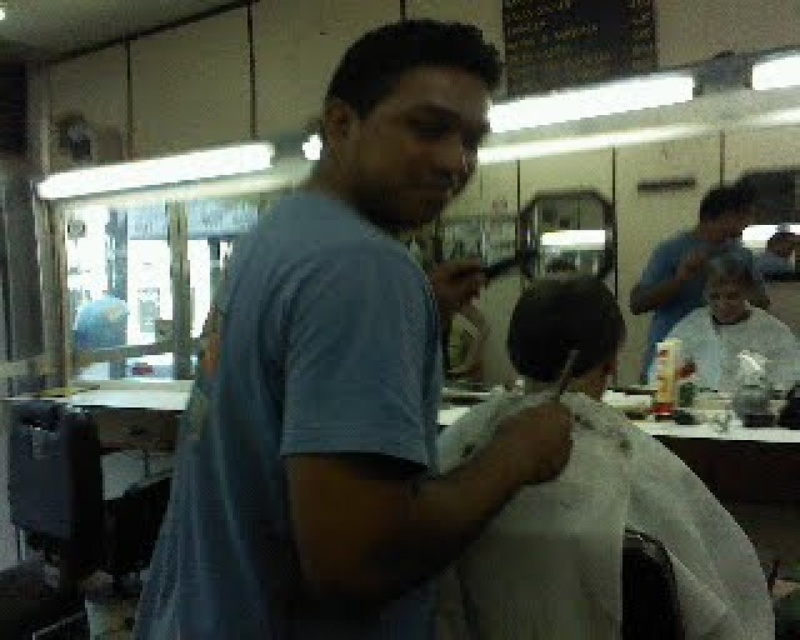
You are a customer entering a barbershop and want to approach the barber wearing the matte blue shirt at upper right. The doorway is 2.5 meters wide. Can you walk through the doorway to reach the barber?

The distance between the matte blue shirt at upper right and the camera is 3.36 meters. However, the question is about the doorway width, which is 2.5 meters. Since the doorway width is sufficient for a person to pass through, you can walk through the doorway to reach the barber wearing the matte blue shirt at upper right.

You are a customer in the barbershop and want to know which dark brown hair is closer to you. The barbershop has two dark brown hair at center and dark brown hair at upper center. Which one is closer?

The dark brown hair at center is closer to you because it is in front of the dark brown hair at upper center.

You are a customer entering the barbershop and see the matte blue shirt at upper right and the white cloth at center. Which object is closer to you?

The matte blue shirt at upper right is closer to you because it is further to the viewer than the white cloth at center.